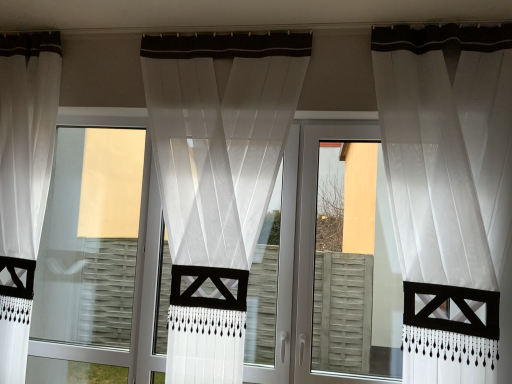
Question: Is transparent fabric screen door at right taller than transparent glass window at center?

Choices:
 (A) yes
 (B) no

Answer: (B)

Question: Is transparent fabric screen door at right not near transparent glass window at center?

Choices:
 (A) yes
 (B) no

Answer: (A)

Question: Is transparent fabric screen door at right oriented towards transparent glass window at center?

Choices:
 (A) no
 (B) yes

Answer: (A)

Question: Considering the relative positions of transparent fabric screen door at right and transparent glass window at center in the image provided, is transparent fabric screen door at right to the left of transparent glass window at center from the viewer's perspective?

Choices:
 (A) no
 (B) yes

Answer: (A)

Question: Is transparent fabric screen door at right not inside transparent glass window at center?

Choices:
 (A) no
 (B) yes

Answer: (B)

Question: Would you say transparent glass window at center is inside or outside white sheer curtain at right, which ranks as the third curtain in left-to-right order?

Choices:
 (A) outside
 (B) inside

Answer: (A)

Question: Looking at their shapes, would you say transparent glass window at center is wider or thinner than white sheer curtain at right, which is counted as the first curtain, starting from the right?

Choices:
 (A) wide
 (B) thin

Answer: (B)

Question: Considering the positions of transparent glass window at center and white sheer curtain at right, which ranks as the third curtain in left-to-right order, in the image, is transparent glass window at center bigger or smaller than white sheer curtain at right, which ranks as the third curtain in left-to-right order,?

Choices:
 (A) big
 (B) small

Answer: (B)

Question: From the image's perspective, relative to white sheer curtain at right, which ranks as the third curtain in left-to-right order, is transparent glass window at center above or below?

Choices:
 (A) above
 (B) below

Answer: (B)

Question: From the image's perspective, is white sheer curtain at left, which is the first curtain in left-to-right order, located above or below sheer white curtain at center, which is counted as the 2th curtain, starting from the right?

Choices:
 (A) above
 (B) below

Answer: (A)

Question: Considering the positions of white sheer curtain at left, arranged as the third curtain when viewed from the right, and sheer white curtain at center, which is counted as the 2th curtain, starting from the right, in the image, is white sheer curtain at left, arranged as the third curtain when viewed from the right, taller or shorter than sheer white curtain at center, which is counted as the 2th curtain, starting from the right,?

Choices:
 (A) tall
 (B) short

Answer: (A)

Question: Is point (31, 94) closer or farther from the camera than point (306, 56)?

Choices:
 (A) closer
 (B) farther

Answer: (B)

Question: Is white sheer curtain at left, arranged as the third curtain when viewed from the right, bigger or smaller than sheer white curtain at center, acting as the second curtain starting from the left?

Choices:
 (A) small
 (B) big

Answer: (A)

Question: From the image's perspective, relative to sheer white curtain at center, acting as the second curtain starting from the left, is transparent fabric screen door at right above or below?

Choices:
 (A) below
 (B) above

Answer: (A)

Question: In the image, is transparent fabric screen door at right positioned in front of or behind sheer white curtain at center, acting as the second curtain starting from the left?

Choices:
 (A) behind
 (B) front

Answer: (A)